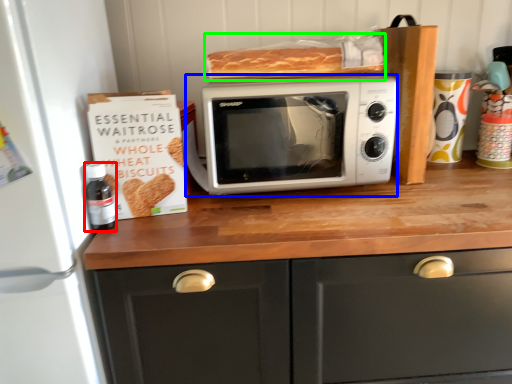
Question: Which object is positioned closest to bottle (highlighted by a red box)? Select from microwave oven (highlighted by a blue box) and food (highlighted by a green box).

Choices:
 (A) microwave oven
 (B) food

Answer: (A)